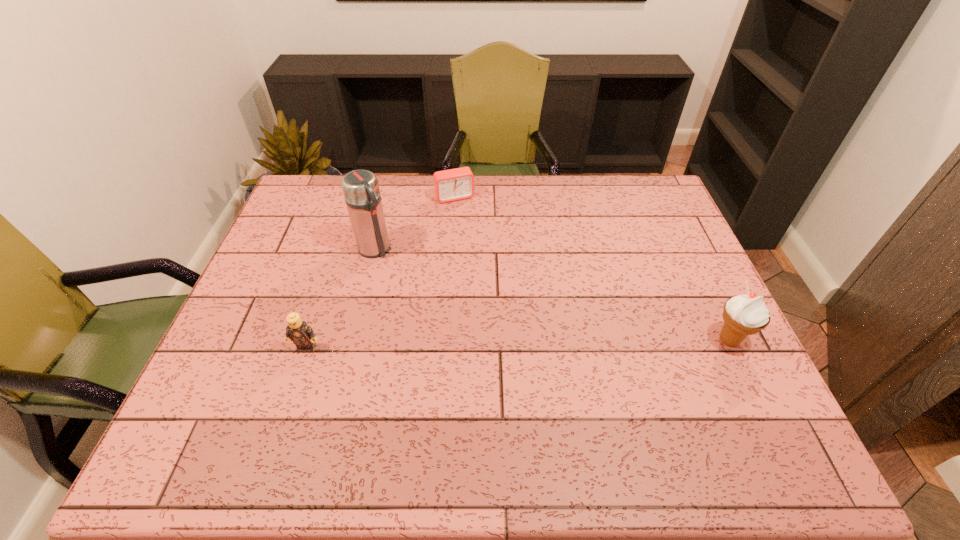
This screenshot has height=540, width=960. In order to click on free spot on the desktop that is between the leftmost object and the third shortest object and is positioned with a handle on the side of the second object from left to right in this screenshot , I will do `click(468, 345)`.

Locate an element on the screen. The width and height of the screenshot is (960, 540). vacant space on the desktop that is between the second shortest object and the icecream and is positioned on the front-facing side of the third object from left to right is located at coordinates (521, 344).